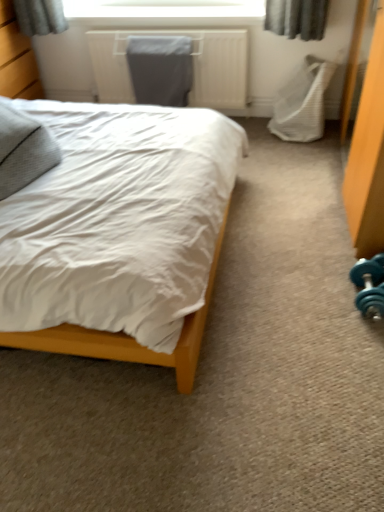
The width and height of the screenshot is (384, 512). Identify the location of free spot above teal rubber dumbbell at lower right (from a real-world perspective). (369, 280).